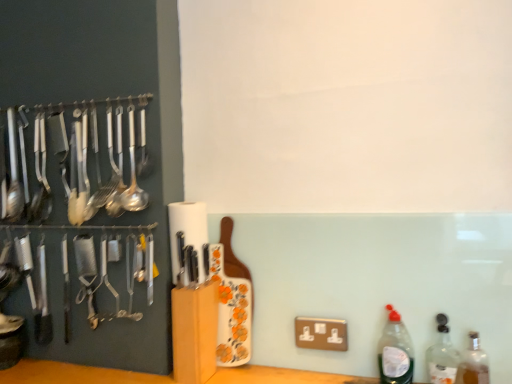
Question: From a real-world perspective, relative to white matte paper towel at center, is polished silver spoon at left vertically above or below?

Choices:
 (A) above
 (B) below

Answer: (A)

Question: In terms of width, does polished silver spoon at left look wider or thinner when compared to white matte paper towel at center?

Choices:
 (A) thin
 (B) wide

Answer: (A)

Question: Estimate the real-world distances between objects in this image. Which object is closer to the translucent plastic bottle at lower right, which is the third bottle in right-to-left order?

Choices:
 (A) polished silver spoon at left
 (B) white matte paper towel at center
 (C) translucent glass bottle at lower right, marked as the 1th bottle in a right-to-left arrangement
 (D) clear glass bottle at right, placed as the second bottle when sorted from left to right

Answer: (D)

Question: Which object is the closest to the translucent plastic bottle at lower right, acting as the 1th bottle starting from the left?

Choices:
 (A) white matte paper towel at center
 (B) translucent glass bottle at lower right, marked as the 1th bottle in a right-to-left arrangement
 (C) clear glass bottle at right, placed as the 2th bottle when sorted from right to left
 (D) polished silver spoon at left

Answer: (C)